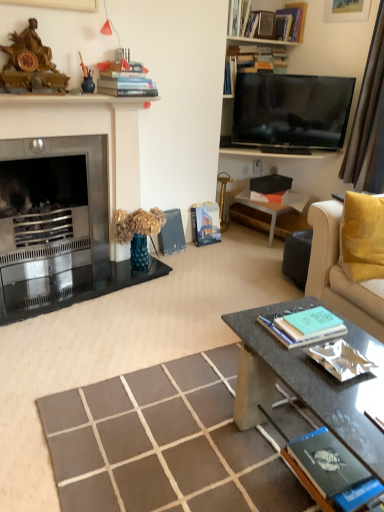
Locate an element on the screen. The height and width of the screenshot is (512, 384). free space to the left of dark gray concrete coffee table at lower right is located at coordinates (169, 432).